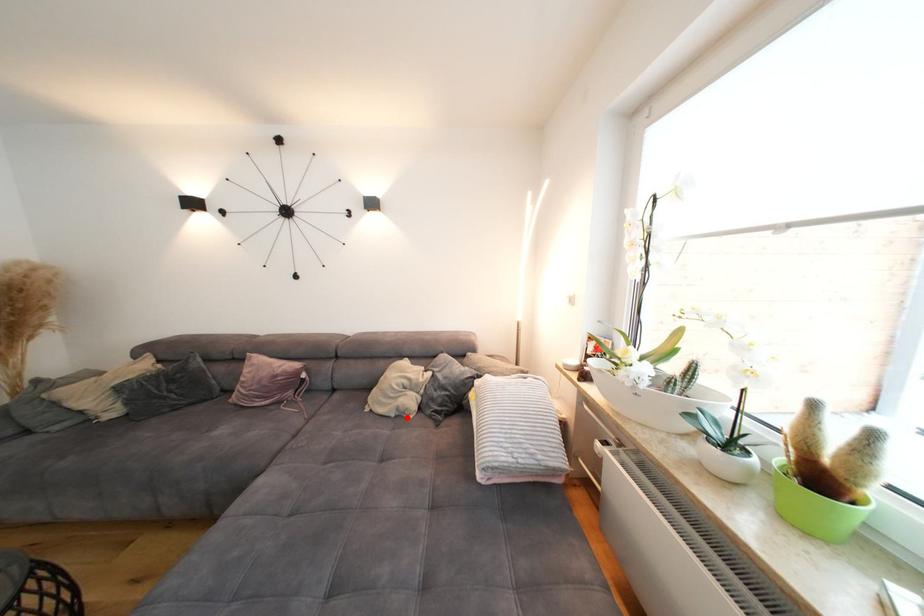
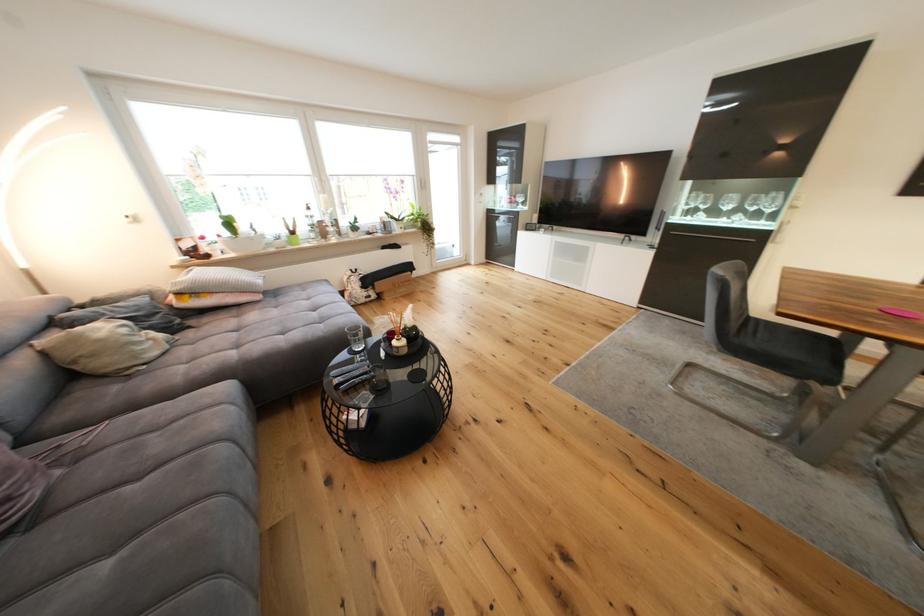
Find the pixel in the second image that matches the highlighted location in the first image.

(178, 345)